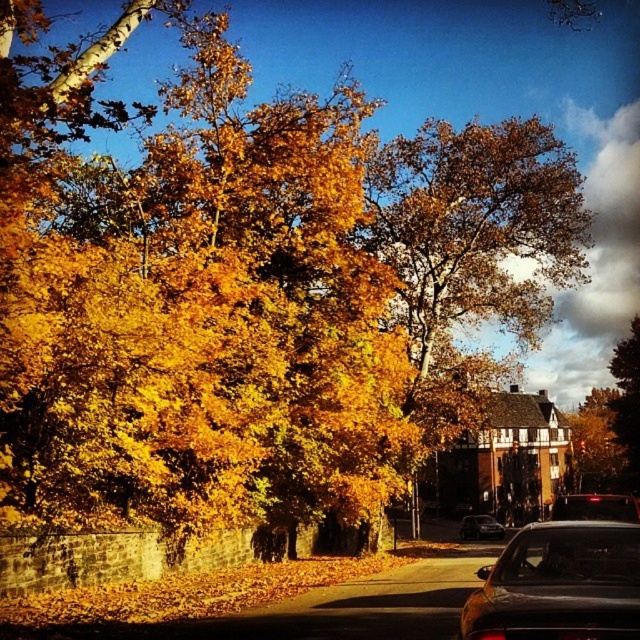
Describe the element at coordinates (472, 248) in the screenshot. The image size is (640, 640). I see `golden leafy tree at center` at that location.

Who is more distant from viewer, (458, 244) or (605, 628)?

Point (458, 244)

The image size is (640, 640). I want to click on golden leafy tree at center, so click(472, 248).

Who is higher up, golden leafy tree at center or satin black sedan at center?

Positioned higher is golden leafy tree at center.

Who is taller, golden leafy tree at center or satin black sedan at center?

golden leafy tree at center

The height and width of the screenshot is (640, 640). Describe the element at coordinates (472, 248) in the screenshot. I see `golden leafy tree at center` at that location.

What are the coordinates of `golden leafy tree at center` in the screenshot? It's located at (472, 248).

Which is behind, point (604, 502) or point (481, 522)?

The point (481, 522) is more distant.

Is point (609, 508) positioned before point (500, 529)?

Yes, it is in front of point (500, 529).

What do you see at coordinates (595, 508) in the screenshot? I see `black glossy car at center` at bounding box center [595, 508].

At what (x,y) coordinates should I click in order to perform the action: click on black glossy car at center. Please return your answer as a coordinate pair (x, y). Looking at the image, I should click on (595, 508).